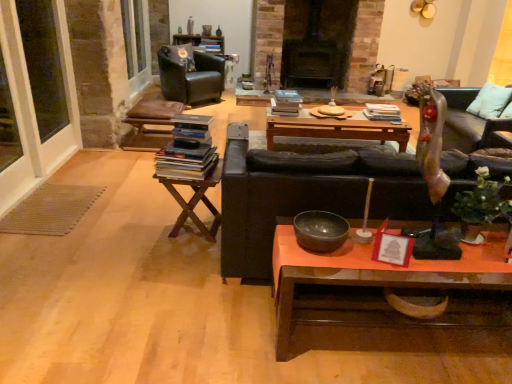
Locate an element on the screen. Image resolution: width=512 pixels, height=384 pixels. vacant area situated to the left side of black leather couch at center is located at coordinates (132, 289).